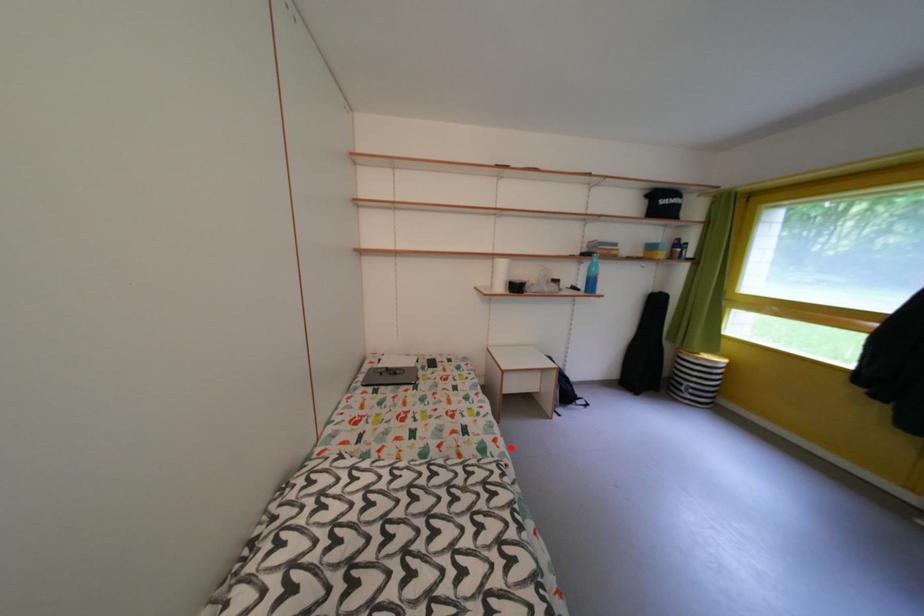
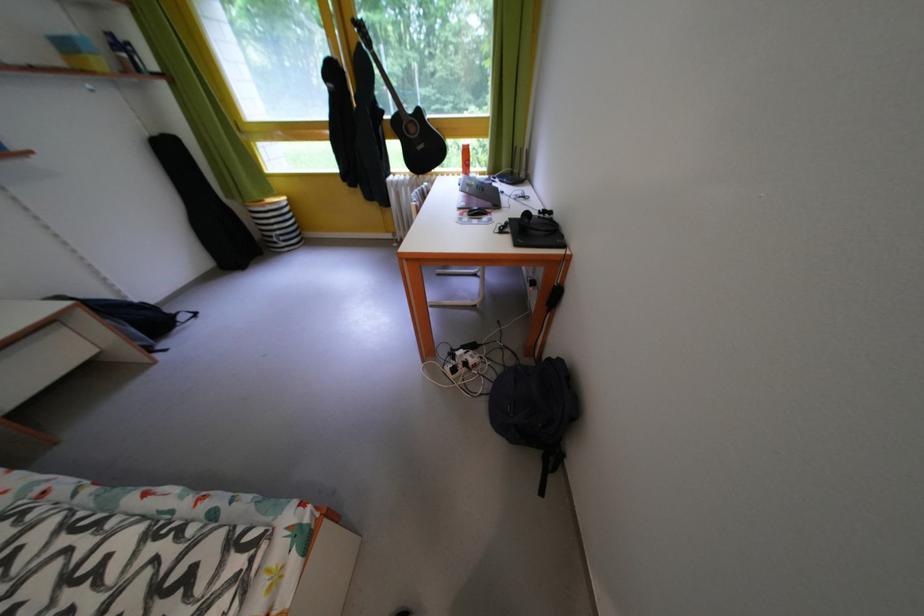
Question: I am providing you with two images of the same scene from different viewpoints. Given a red point in image1, look at the same physical point in image2. Is it:

Choices:
 (A) Closer to the viewpoint
 (B) Farther from the viewpoint

Answer: (B)